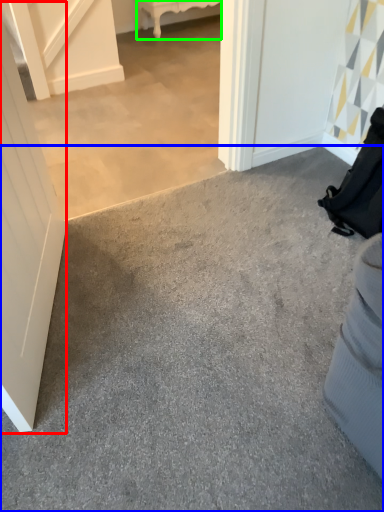
Question: Which is farther away from door (highlighted by a red box)? concrete (highlighted by a blue box) or furniture (highlighted by a green box)?

Choices:
 (A) concrete
 (B) furniture

Answer: (B)